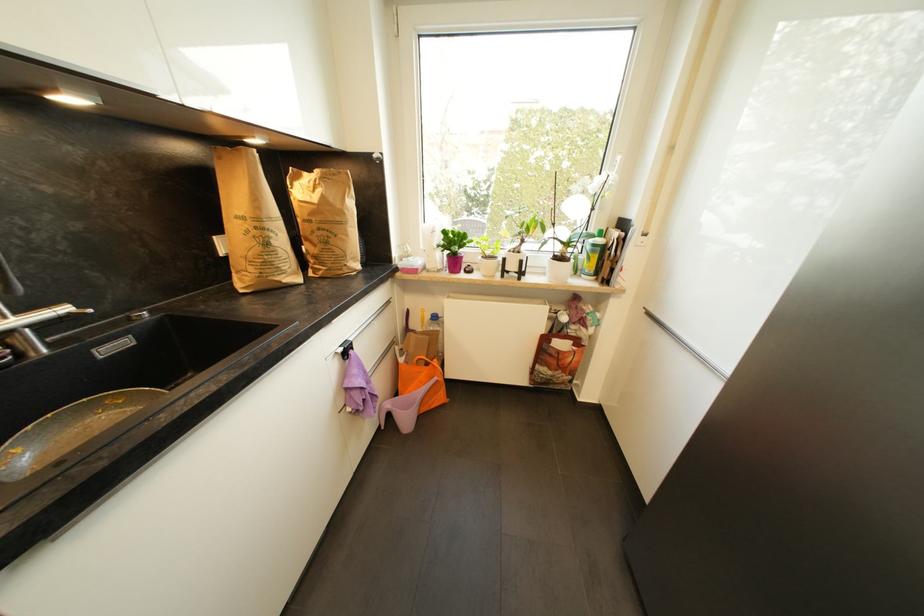
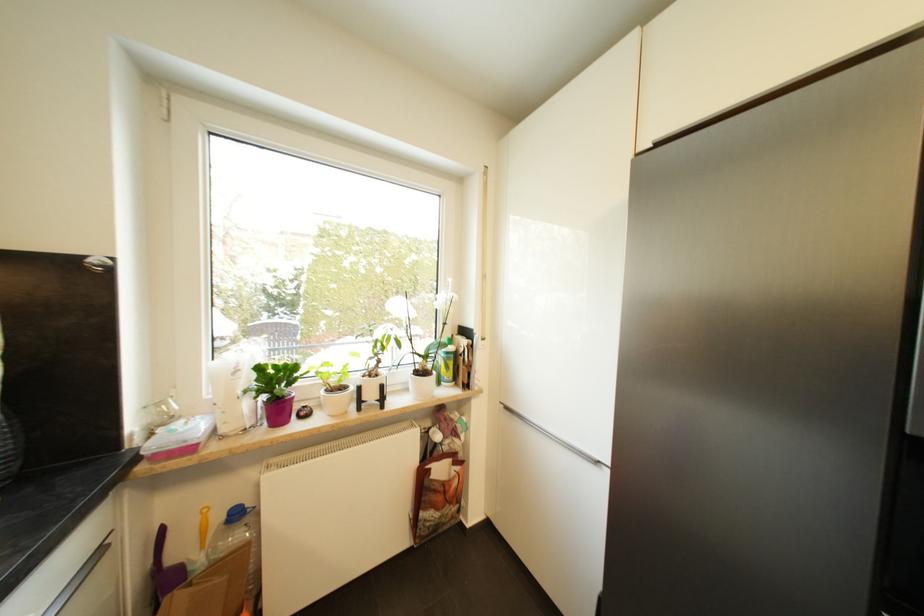
Locate, in the second image, the point that corresponds to the point at 394,304 in the first image.

(105, 553)